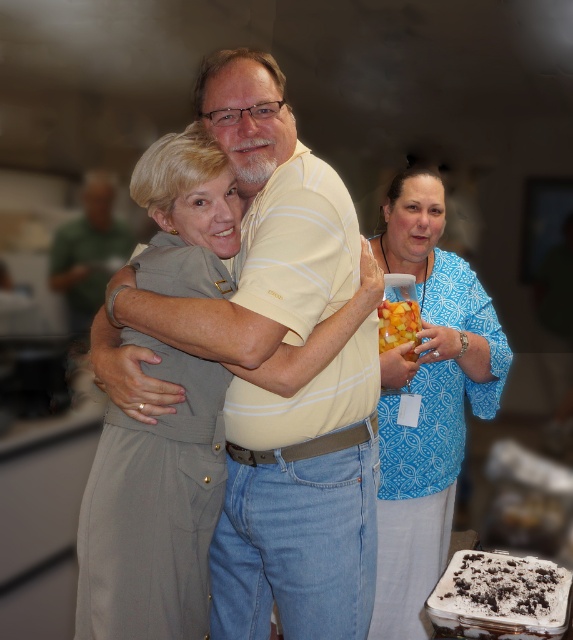
You are at the gathering and want to get a snack from the container held by the person in the blue patterned blouse at center. To reach the container, you need to move towards the direction where the blouse is located. Based on the coordinates provided, is the blouse positioned more to the right or left side of the image?

The blue patterned blouse at center is located at coordinates point (427,401). Since the x coordinate is 0.628, which is greater than 0.5, it is positioned more to the right side of the image.

You are a photographer at a social event and need to capture a closeup shot of the blue patterned blouse at center and the translucent plastic cup at center. The minimum focus distance for your camera is 8 inches. Can you focus on both objects without moving the camera?

The blue patterned blouse at center is 8.74 inches from the translucent plastic cup at center. Since the distance between them is greater than the camera minimum focus distance of 8 inches, you can focus on both objects without moving the camera.